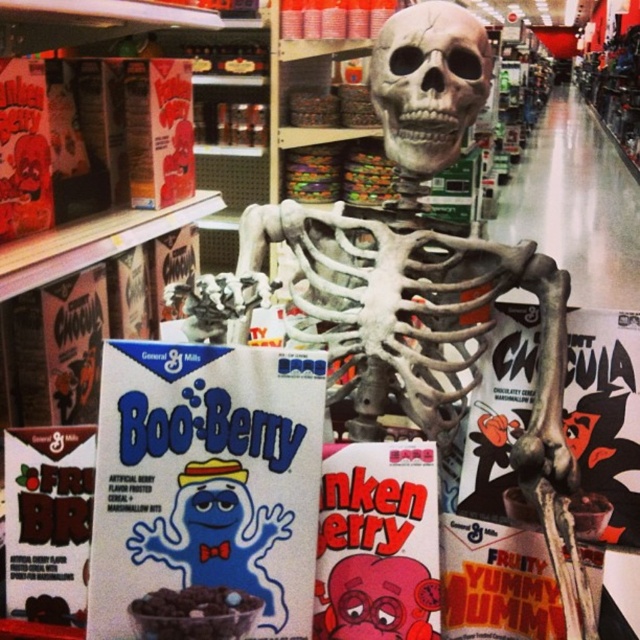
You are a grocery store employee who needs to ensure all items are placed correctly. The store policy states that the tallest item must be placed on the bottom shelf for stability. Given that you have the gray matte skull at center and the smooth chocolate cereal at center, which item should be placed on the bottom shelf?

The gray matte skull at center is taller than the smooth chocolate cereal at center, so it should be placed on the bottom shelf to follow the store policy.

You are a grocery store employee who needs to place the gray matte skull at center and the fruity yummy mummy cereal at center on a shelf. The shelf has a height limit of 12 inches. Can both items fit vertically on the shelf without exceeding the height limit?

The gray matte skull at center is bigger than the fruity yummy mummy cereal at center. However, the exact heights of each item are not provided in the description. Therefore, it is impossible to determine if both items can fit vertically on the shelf without exceeding the 12 inch height limit.

You are a customer in the grocery store and want to find the gray matte skull at center. According to the store map, the point where the gray matte skull at center is located is marked as point (428, 83). Can you tell me what coordinates the gray matte skull at center is at?

The gray matte skull at center is located at point (428, 83).